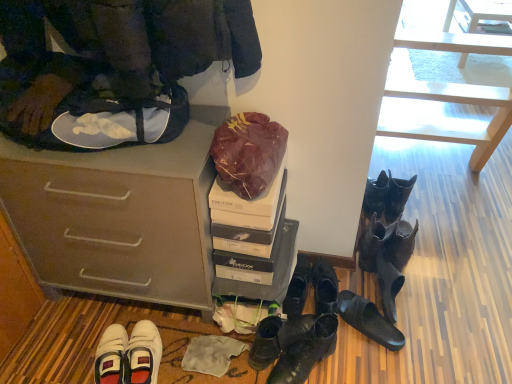
Locate an element on the screen. This screenshot has width=512, height=384. blank space situated above shiny black boots at center, the 7th footwear viewed from the right (from a real-world perspective) is located at coordinates (303, 341).